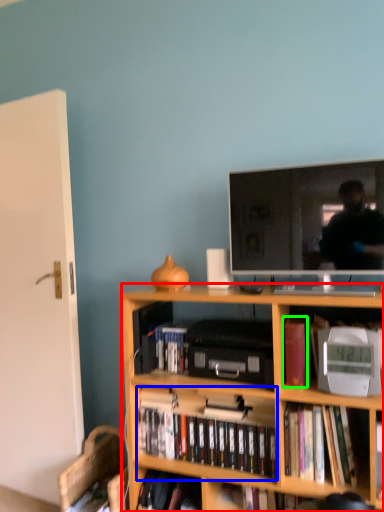
Question: Based on their relative distances, which object is nearer to bookcase (highlighted by a red box)? Choose from book (highlighted by a blue box) and book (highlighted by a green box).

Choices:
 (A) book
 (B) book

Answer: (A)